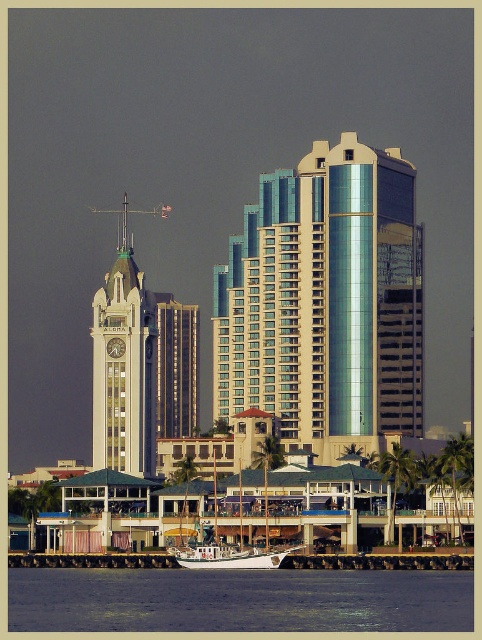
Question: Which point is farther to the camera?

Choices:
 (A) (26, 586)
 (B) (329, 420)
 (C) (117, 308)
 (D) (242, 563)

Answer: (B)

Question: Does wooden dock at lower center come behind white matte boat at lower center?

Choices:
 (A) yes
 (B) no

Answer: (A)

Question: Can you confirm if blue water at lower center is positioned above white matte boat at lower center?

Choices:
 (A) no
 (B) yes

Answer: (A)

Question: Can you confirm if shiny glass building at center is bigger than white matte boat at lower center?

Choices:
 (A) yes
 (B) no

Answer: (A)

Question: Which of the following is the farthest from the observer?

Choices:
 (A) (119, 413)
 (B) (369, 596)
 (C) (204, 563)
 (D) (430, 561)

Answer: (A)

Question: Which object is closer to the camera taking this photo?

Choices:
 (A) white matte boat at lower center
 (B) white matte boat at center
 (C) blue water at lower center

Answer: (C)